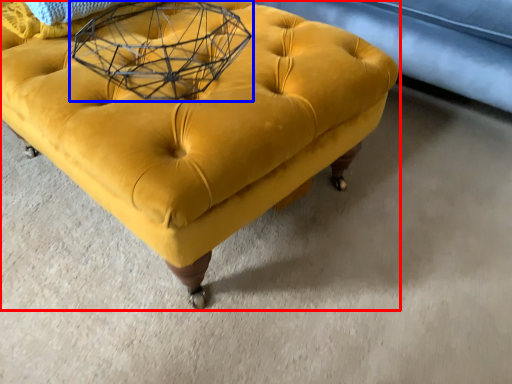
Question: Which of the following is the closest to the observer, furniture (highlighted by a red box) or round table (highlighted by a blue box)?

Choices:
 (A) furniture
 (B) round table

Answer: (A)